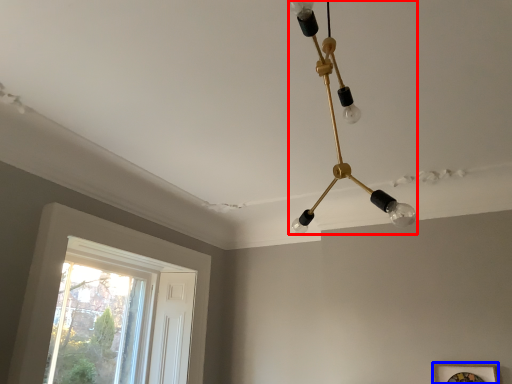
Question: Which object appears farthest to the camera in this image, lamp (highlighted by a red box) or picture frame (highlighted by a blue box)?

Choices:
 (A) lamp
 (B) picture frame

Answer: (B)